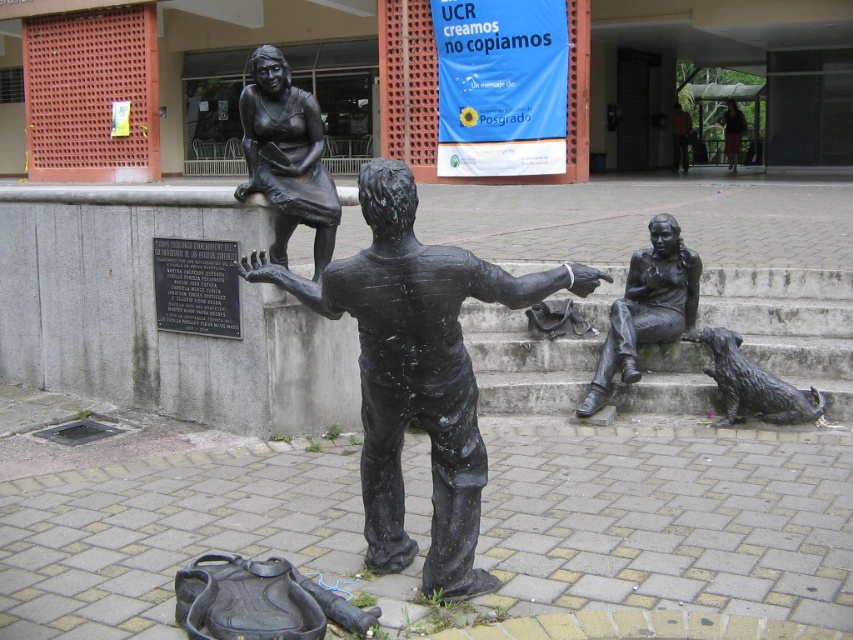
In the scene shown: You are a photographer trying to capture a clear shot of the bronze statue of woman sitting at right and the shiny bronze dog at lower right. Based on their positions, which object should you focus on first if you want to ensure both are in focus without moving your camera? Explain your reasoning using their spatial relationship.

The bronze statue of woman sitting at right is above the shiny bronze dog at lower right. To capture both in focus, you should focus on the bronze statue of woman sitting at right first, as it is closer to the camera, ensuring the dog at lower right will also be in focus due to the depth of field.

You are an art student analyzing the sculpture in the public space. You notice two statues described as bronze statue at center and dark brown statue at center. Which one is shorter?

The bronze statue at center is shorter than the dark brown statue at center.

You are a photographer wanting to capture both the bronze statue of woman at upper left and the bronze statue of woman sitting at right in a single frame. Based on their positions, which statue would appear higher in your photo?

The bronze statue of woman at upper left appears higher in the photo because it is located above the bronze statue of woman sitting at right.